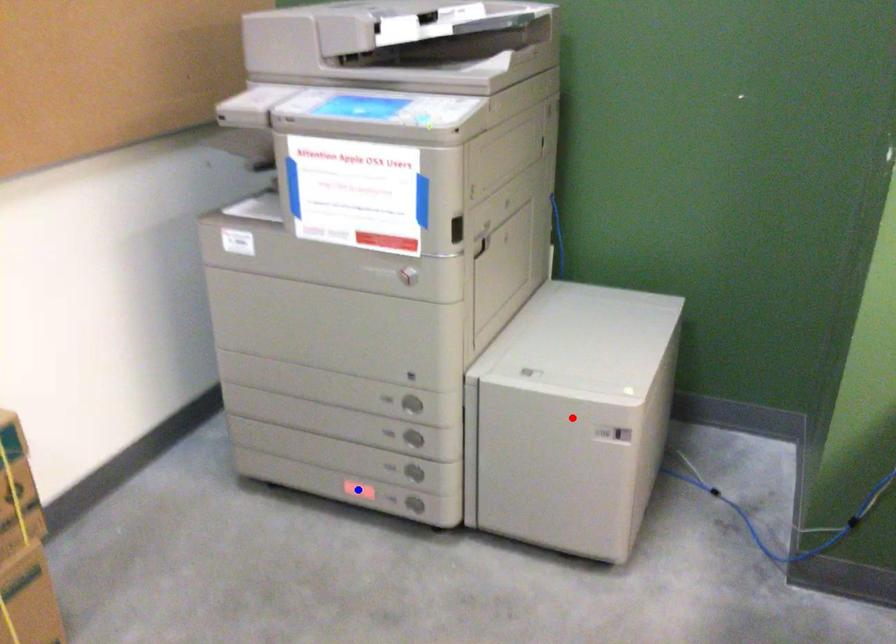
Question: Which of the two points in the image is closer to the camera?

Choices:
 (A) Blue point is closer.
 (B) Red point is closer.

Answer: (B)